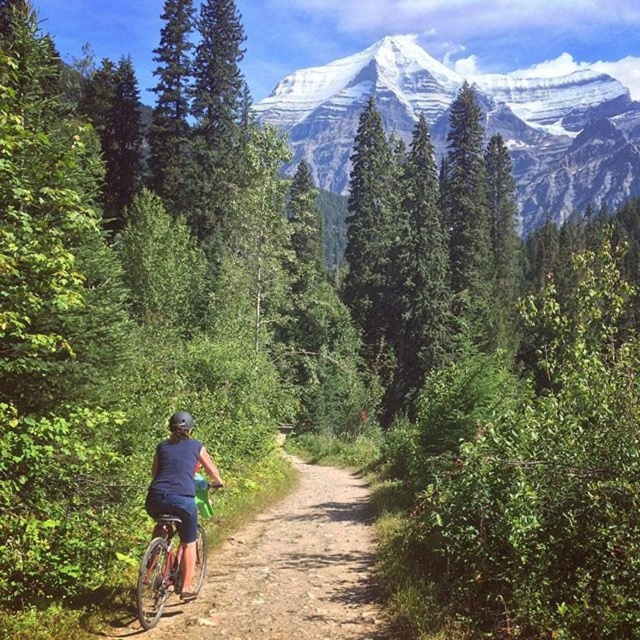
Question: Which point is farther to the camera?

Choices:
 (A) (419, 100)
 (B) (157, 467)

Answer: (A)

Question: Does blue fabric shorts at lower center have a smaller size compared to metallic silver bicycle at center?

Choices:
 (A) yes
 (B) no

Answer: (B)

Question: Is metallic silver bicycle at center closer to the viewer compared to matte black helmet at center?

Choices:
 (A) no
 (B) yes

Answer: (B)

Question: Among these objects, which one is nearest to the camera?

Choices:
 (A) matte black helmet at center
 (B) snowy granite mountain at upper center
 (C) blue fabric shorts at lower center

Answer: (C)

Question: Among these points, which one is farthest from the camera?

Choices:
 (A) (182, 564)
 (B) (170, 429)

Answer: (B)

Question: Can you confirm if blue fabric shorts at lower center is thinner than matte black helmet at center?

Choices:
 (A) no
 (B) yes

Answer: (A)